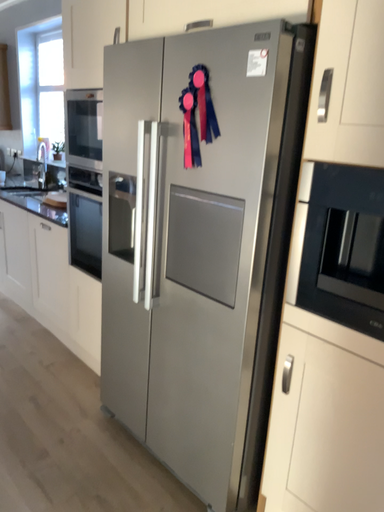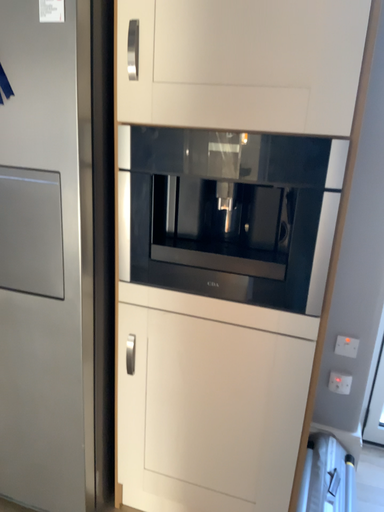
Question: How did the camera likely rotate when shooting the video?

Choices:
 (A) rotated left
 (B) rotated right

Answer: (B)